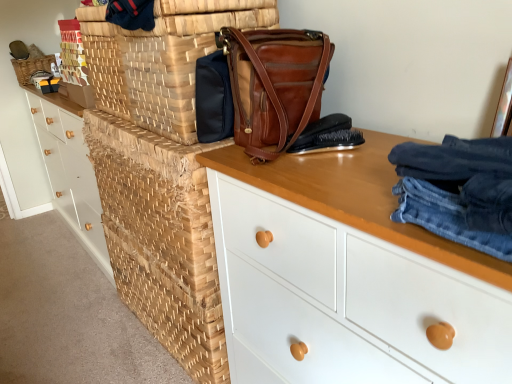
At what (x,y) coordinates should I click in order to perform the action: click on free space to the left of brown leather brush at center. Please return your answer as a coordinate pair (x, y). The image size is (512, 384). Looking at the image, I should click on (255, 168).